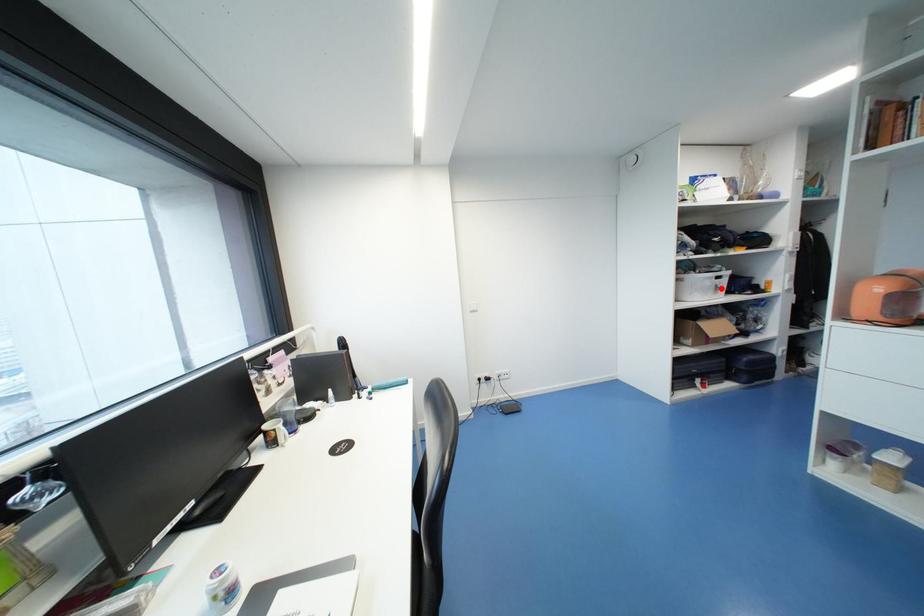
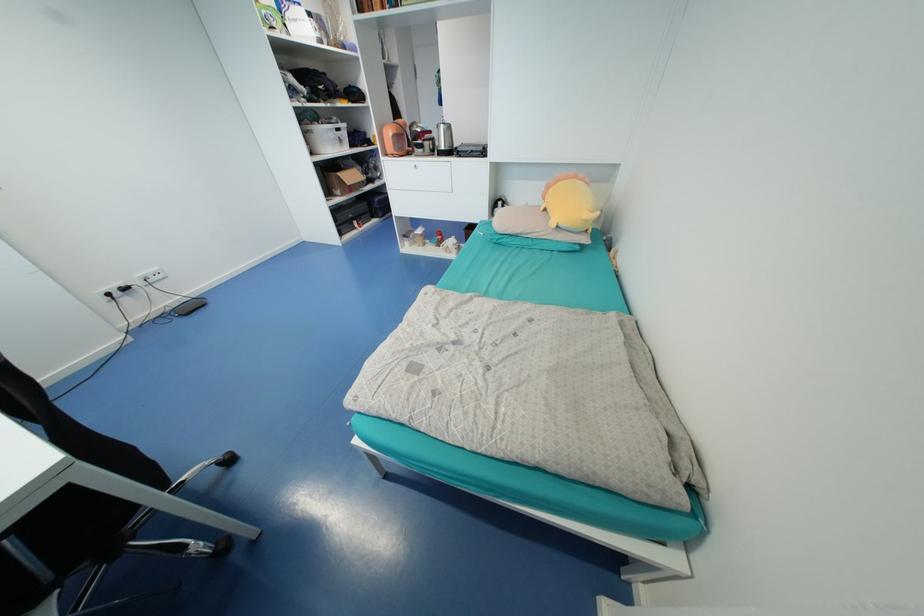
The point at the highlighted location is marked in the first image. Where is the corresponding point in the second image?

(345, 140)